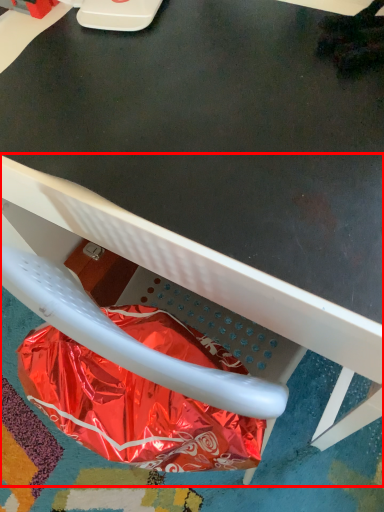
Question: In this image, where is chair (annotated by the red box) located relative to paper bag?

Choices:
 (A) left
 (B) right

Answer: (B)